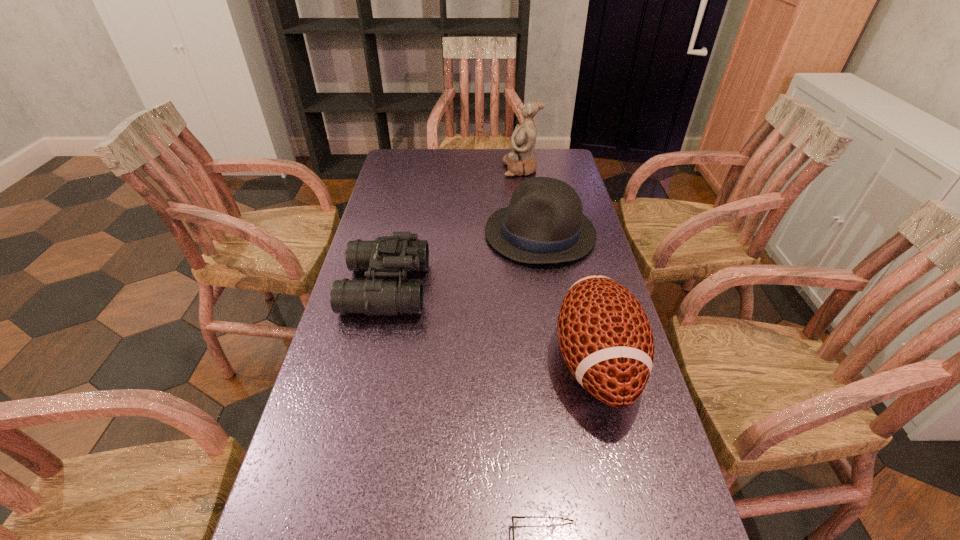
Find the location of a particular element. The width and height of the screenshot is (960, 540). free space between the leftmost object and the football is located at coordinates (492, 325).

I want to click on free spot between the tallest object and the football, so click(x=559, y=266).

Point out which object is positioned as the second nearest to the shortest object. Please provide its 2D coordinates. Your answer should be formatted as a tuple, i.e. [(x, y)], where the tuple contains the x and y coordinates of a point satisfying the conditions above.

[(392, 256)]

I want to click on object that is the third closest to the football, so click(392, 256).

The width and height of the screenshot is (960, 540). Find the location of `free space that satisfies the following two spatial constraints: 1. on the back side of the football; 2. through the lenses of the leftmost object`. free space that satisfies the following two spatial constraints: 1. on the back side of the football; 2. through the lenses of the leftmost object is located at coordinates point(578,288).